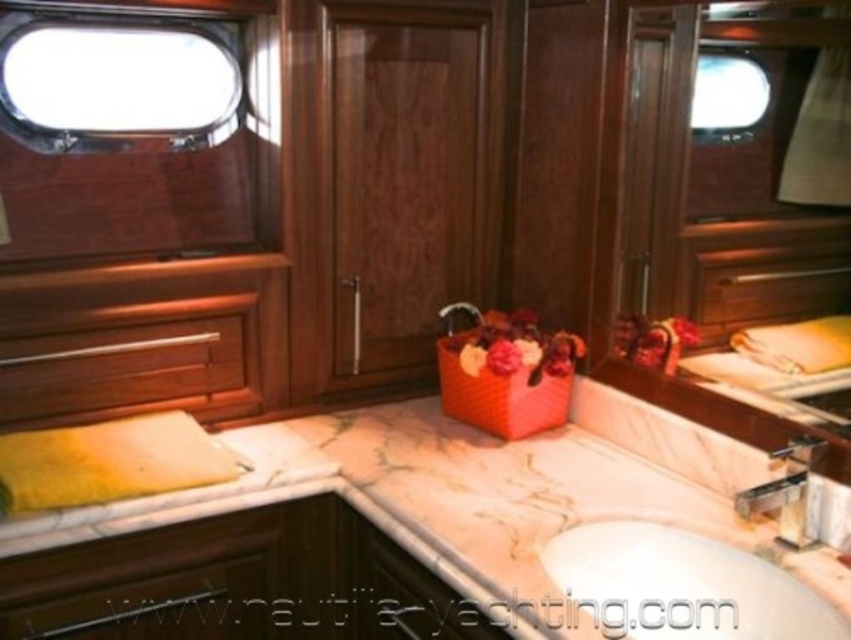
Consider the image. You are a guest in this yacht bathroom and want to wash your hands. The white glossy sink at center and the satin nickel faucet at center are both in front of you. Which one should you approach first to turn on the water?

You should approach the satin nickel faucet at center first because the white glossy sink at center is to the right of it, meaning the faucet is positioned to the left of the sink and closer to your starting position.

You are a guest in this yacht bathroom and want to place a small decorative item on the surface that is closer to you. Which object should you choose between the marble at center and the silver metallic faucet at center?

The marble at center is closer to the viewer than the silver metallic faucet at center, so you should place the decorative item on the marble at center.